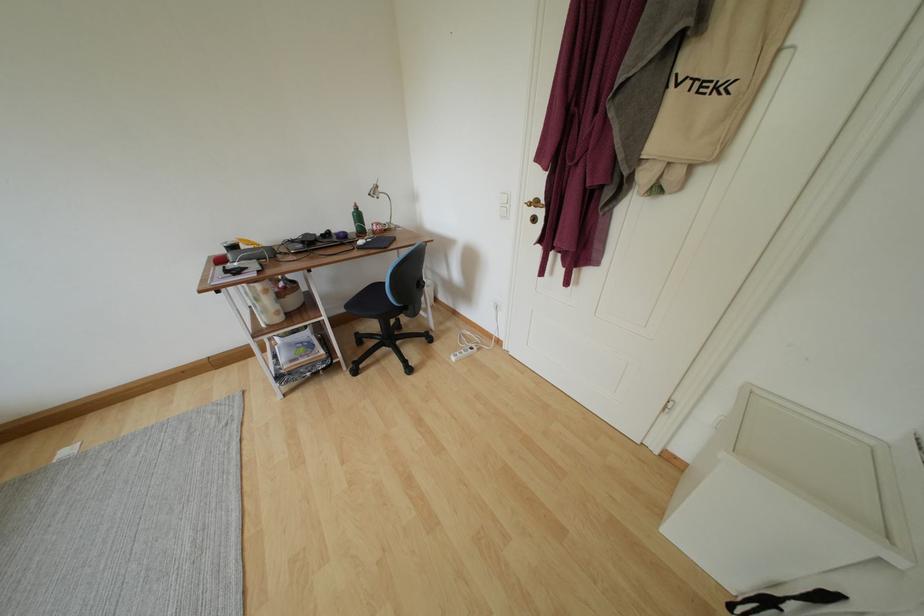
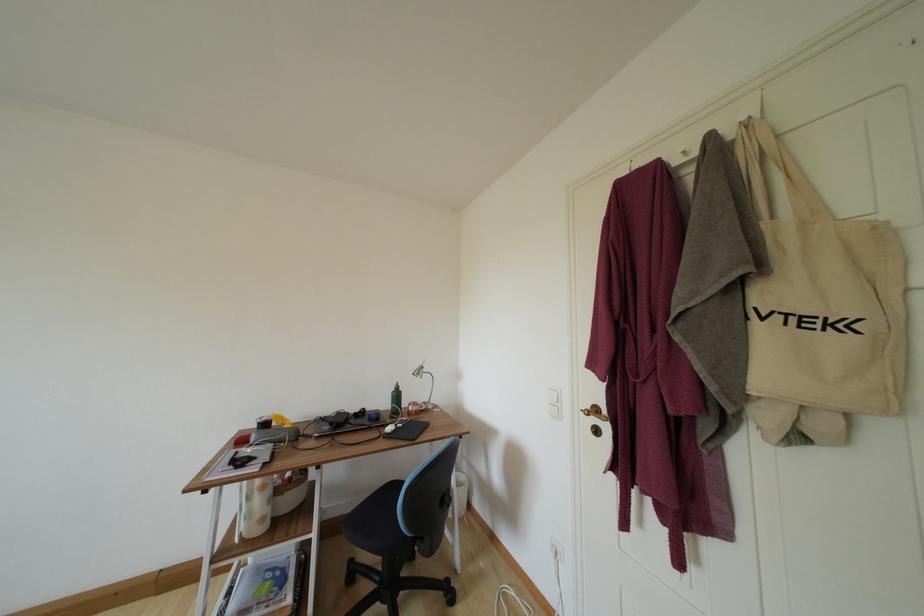
Locate, in the second image, the point that corresponds to (x=347, y=315) in the first image.

(354, 514)